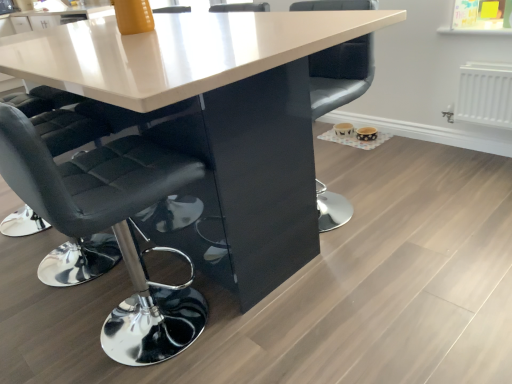
Question: Considering the positions of black leather chair at left, acting as the second chair starting from the right, and black leather chair at center, arranged as the first chair when viewed from the right, in the image, is black leather chair at left, acting as the second chair starting from the right, bigger or smaller than black leather chair at center, arranged as the first chair when viewed from the right,?

Choices:
 (A) big
 (B) small

Answer: (A)

Question: From a real-world perspective, is black leather chair at left, which appears as the 1th chair when viewed from the left, positioned above or below black leather chair at center, which is the second chair in left-to-right order?

Choices:
 (A) above
 (B) below

Answer: (A)

Question: Which object is positioned farthest from the white glossy table at center?

Choices:
 (A) black leather chair at left, acting as the second chair starting from the right
 (B) black leather chair at center, arranged as the first chair when viewed from the right

Answer: (B)

Question: Estimate the real-world distances between objects in this image. Which object is closer to the white glossy table at center?

Choices:
 (A) black leather chair at left, which appears as the 1th chair when viewed from the left
 (B) black leather chair at center, which is the second chair in left-to-right order

Answer: (A)